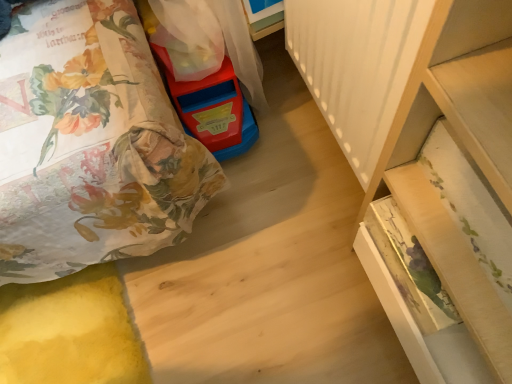
Question: Considering their positions, is rubberized plastic toy at upper left located in front of or behind wooden drawer at lower right?

Choices:
 (A) behind
 (B) front

Answer: (A)

Question: Is rubberized plastic toy at upper left bigger or smaller than wooden drawer at lower right?

Choices:
 (A) small
 (B) big

Answer: (A)

Question: Looking at their shapes, would you say rubberized plastic toy at upper left is wider or thinner than wooden drawer at lower right?

Choices:
 (A) thin
 (B) wide

Answer: (B)

Question: From a real-world perspective, relative to rubberized plastic toy at upper left, is wooden drawer at lower right vertically above or below?

Choices:
 (A) above
 (B) below

Answer: (A)

Question: Considering their positions, is wooden drawer at lower right located in front of or behind rubberized plastic toy at upper left?

Choices:
 (A) behind
 (B) front

Answer: (B)

Question: Looking at their shapes, would you say wooden drawer at lower right is wider or thinner than rubberized plastic toy at upper left?

Choices:
 (A) thin
 (B) wide

Answer: (A)

Question: From the image's perspective, is wooden drawer at lower right above or below rubberized plastic toy at upper left?

Choices:
 (A) above
 (B) below

Answer: (B)